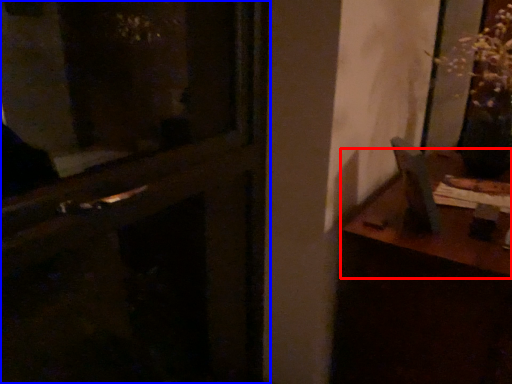
Question: Which point is closer to the camera, table (highlighted by a red box) or door (highlighted by a blue box)?

Choices:
 (A) table
 (B) door

Answer: (B)